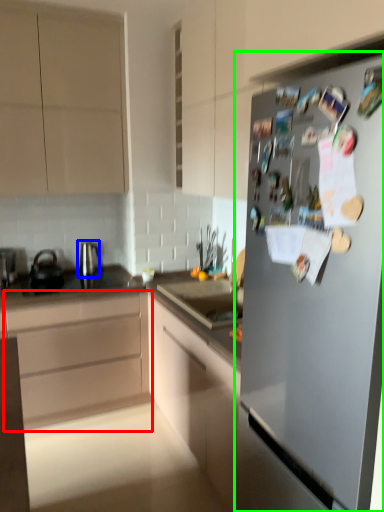
Question: Which object is the closest to the cabinetry (highlighted by a red box)? Choose among these: tea pot (highlighted by a blue box) or refrigerator (highlighted by a green box).

Choices:
 (A) tea pot
 (B) refrigerator

Answer: (A)